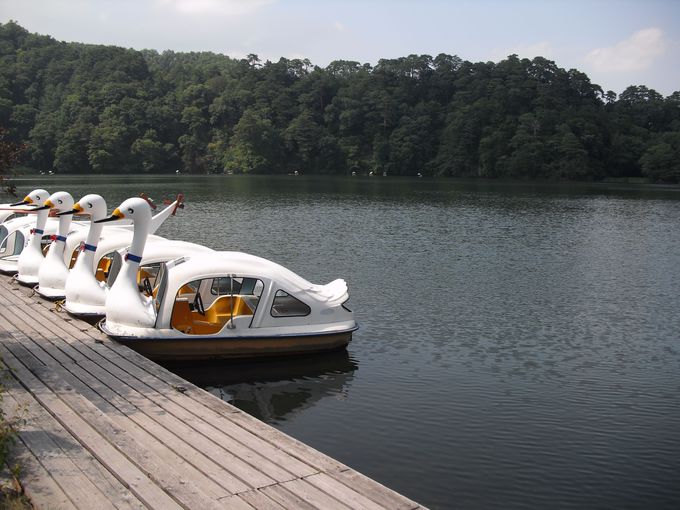
At what (x,y) coordinates should I click in order to perform the action: click on seat. Please return your answer as a coordinate pair (x, y). Image resolution: width=680 pixels, height=510 pixels. Looking at the image, I should click on (221, 318).